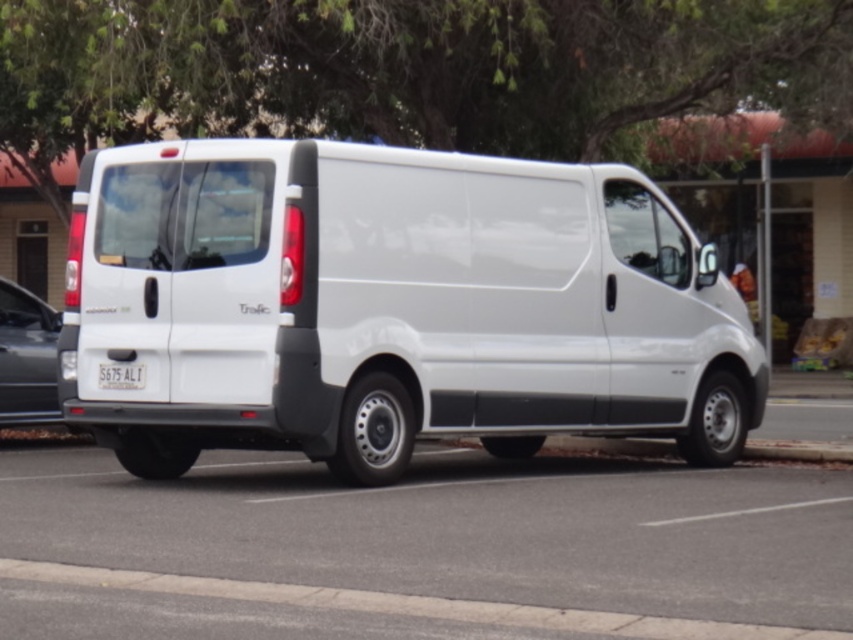
Question: Can you confirm if white matte van at center is bigger than white plastic license plate at center?

Choices:
 (A) no
 (B) yes

Answer: (B)

Question: Among these points, which one is nearest to the camera?

Choices:
 (A) (115, 385)
 (B) (28, 310)
 (C) (634, 449)
 (D) (421, 301)

Answer: (A)

Question: Which object is the farthest from the concrete at lower center?

Choices:
 (A) matte black car at left
 (B) white matte van at center

Answer: (A)

Question: Does matte black car at left appear on the left side of white plastic license plate at center?

Choices:
 (A) yes
 (B) no

Answer: (A)

Question: Is white matte van at center closer to the viewer compared to matte black car at left?

Choices:
 (A) no
 (B) yes

Answer: (B)

Question: Which of the following is the closest to the observer?

Choices:
 (A) (602, 264)
 (B) (796, 452)
 (C) (97, 385)

Answer: (C)